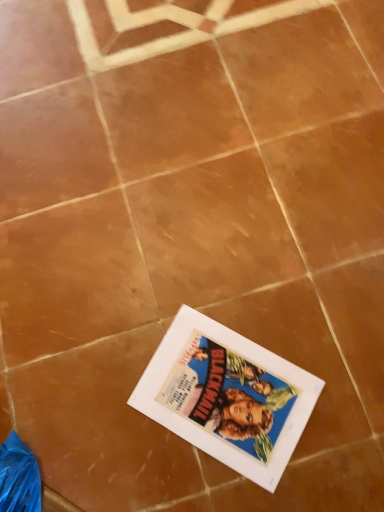
Where is `vacant area located to the right-hand side of matte paper book cover at center`? vacant area located to the right-hand side of matte paper book cover at center is located at coordinates (325, 355).